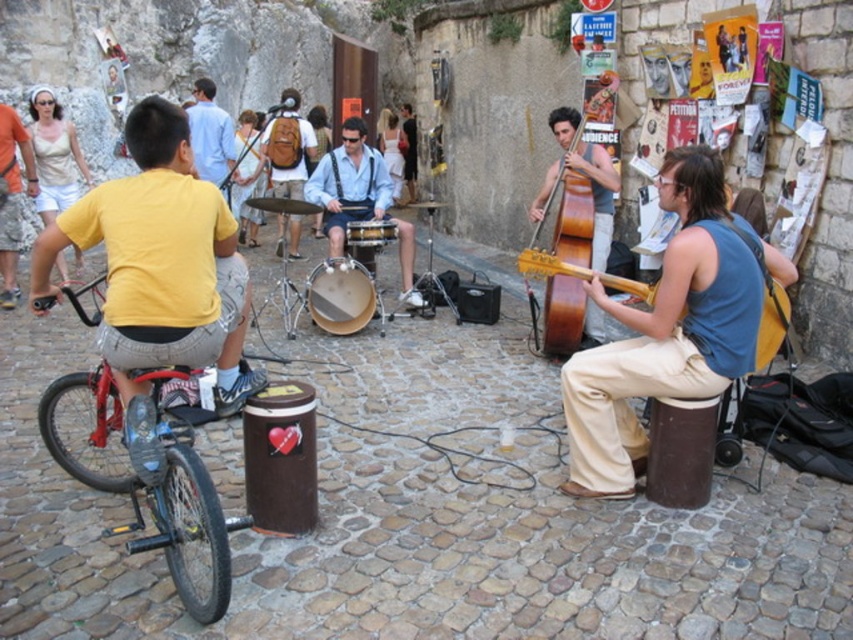
You are a street performer who needs to move your equipment. You have a brown wooden cello at center and a smooth brown drum at center. If you want to place them side by side on a 3.5 meter wide stage, will they fit without overlapping?

The distance between the brown wooden cello at center and smooth brown drum at center is 2.03 meters. Since the stage is 3.5 meters wide, which is wider than 2.03 meters, they can be placed side by side without overlapping.

You are a photographer standing in the middle of the cobblestone street. You notice the light blue denim shorts at center and the brown wooden cello at center. Which object is positioned closer to the left side of the scene?

The light blue denim shorts at center are positioned to the left of the brown wooden cello at center, so they are closer to the left side of the scene.

You are a street performer who needs to place your brown wooden cello at center and smooth brown drum at center side by side on a narrow stage. Based on the scene, can you fit both instruments next to each other without overlapping?

The brown wooden cello at center is wider than the smooth brown drum at center. Since their combined width may exceed the stage space, it depends on the stage size. However, the description only states the cello is wider than the drum, but doesn not provide exact measurements. Without knowing the stage dimensions, we cannot confirm if they fit. Please check the stage width against the total width of both instruments.